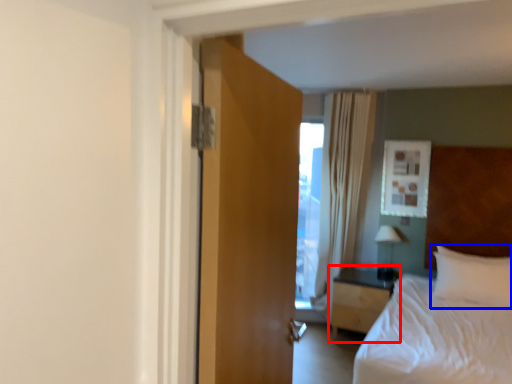
Question: Which point is further to the camera, nightstand (highlighted by a red box) or pillow (highlighted by a blue box)?

Choices:
 (A) nightstand
 (B) pillow

Answer: (A)